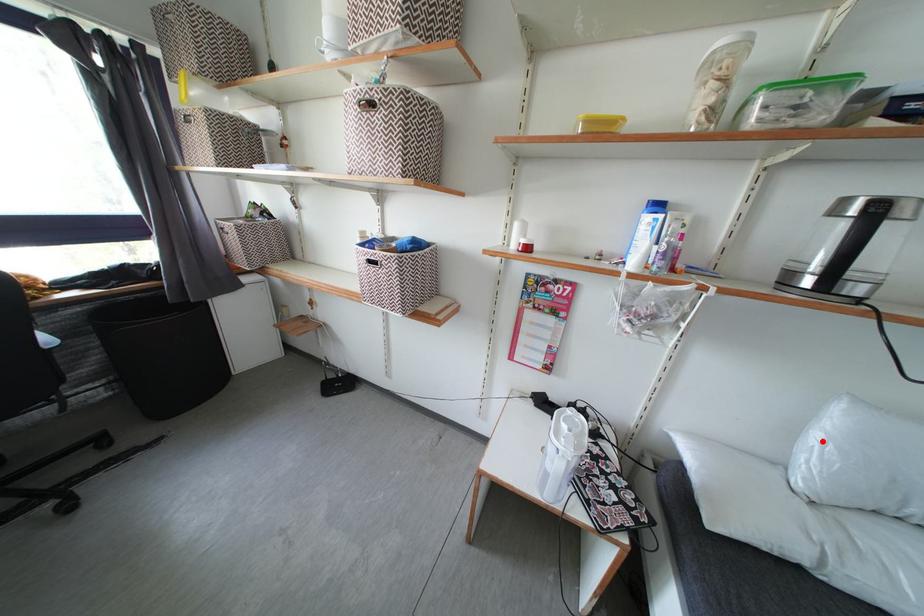
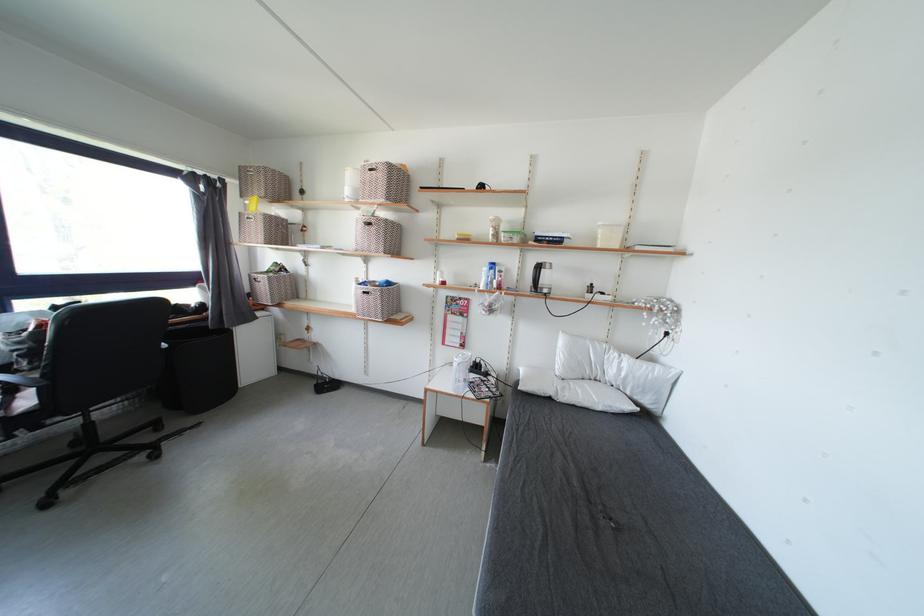
Question: I am providing you with two images of the same scene from different viewpoints. A red point is shown in image1. For the corresponding object point in image2, is it positioned nearer or farther from the camera?

Choices:
 (A) Nearer
 (B) Farther

Answer: (A)